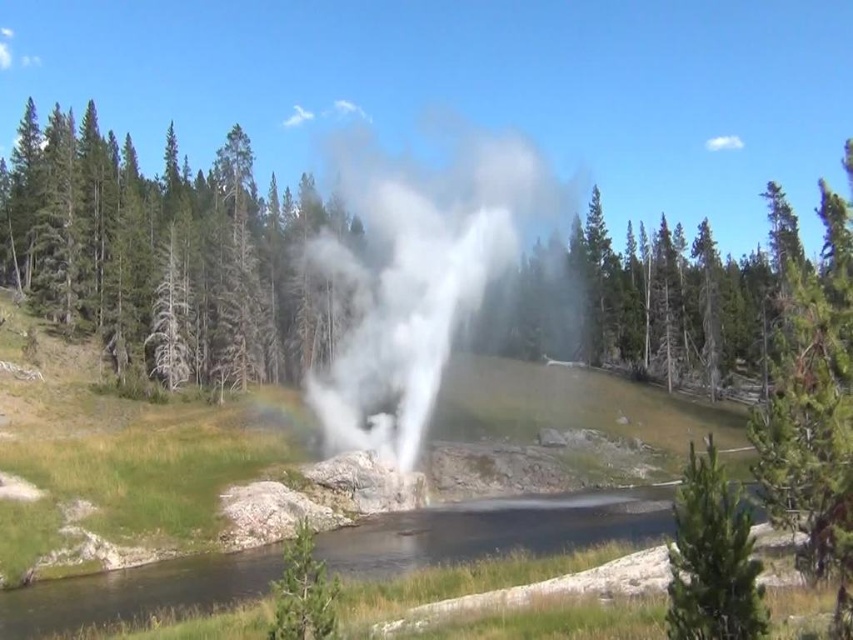
Consider the image. You are a geologist examining the image of the geothermal area. You notice a point marked at coordinates (418,276). What is located at that specific point?

At point (418,276) lies white vapor at center.

You are a hiker who wants to take a photo of the white vapor at center and the green textured pine at lower right. Which object should you focus on first if you want to capture both in a single frame without moving the camera?

You should focus on the white vapor at center first because it is larger in size than the green textured pine at lower right, allowing it to be the main subject while the pine can be included in the background or side.

You are standing at the viewpoint and see two points marked in the image. Which point is closer to you, point (372, 368) or point (668, 621)?

Point (668, 621) is closer to you because it is in front of point (372, 368) according to their spatial relationship.